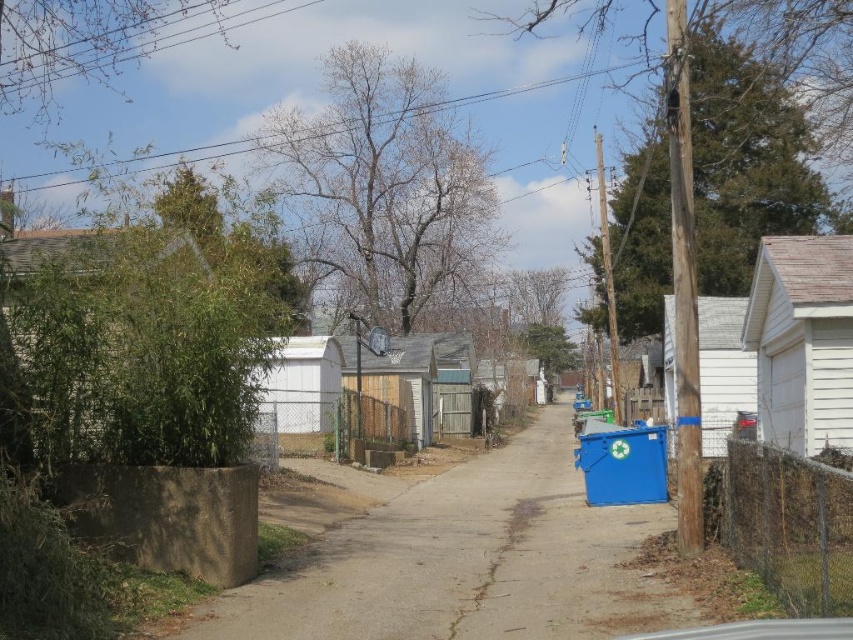
You are a delivery person trying to place a large package in the alley. The package is taller than the wire mesh fence at lower right. Can the blue plastic bin at right also fit the package inside it?

The blue plastic bin at right is taller than the wire mesh fence at lower right. Since the package is taller than the fence, and the bin is taller than the fence, it is possible that the bin can accommodate the package. However, without knowing the exact dimensions of the bin and the package, it is uncertain. The answer depends on whether the bin has sufficient height to contain the package.